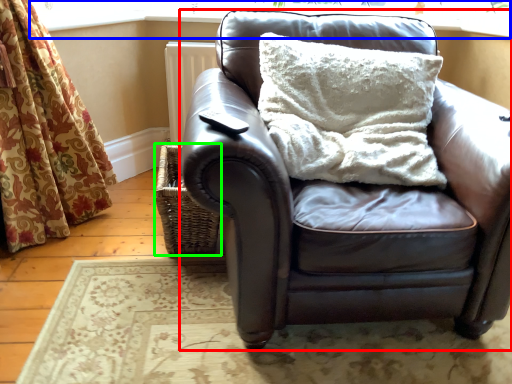
Question: Which is nearer to the studio couch (highlighted by a red box)? window frame (highlighted by a blue box) or basket (highlighted by a green box).

Choices:
 (A) window frame
 (B) basket

Answer: (B)